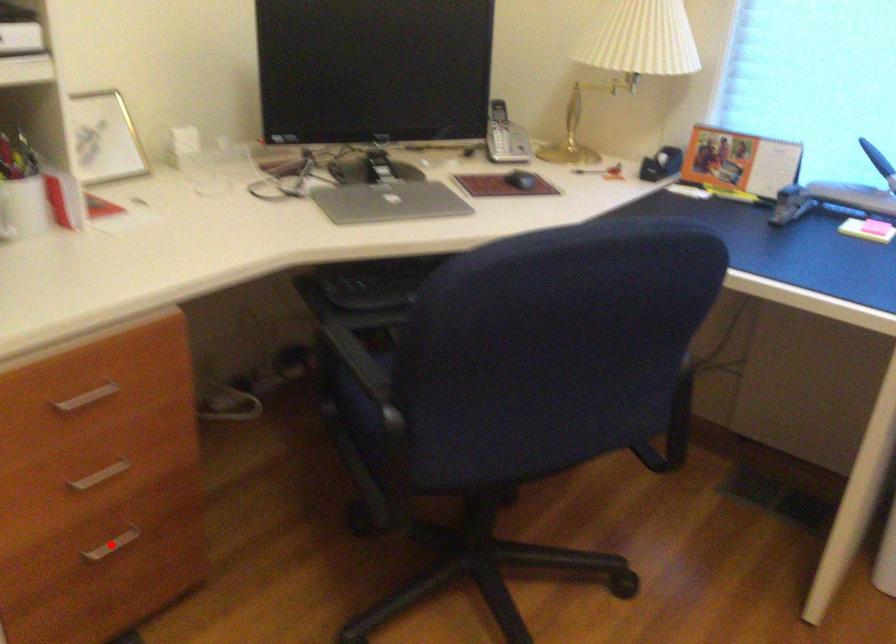
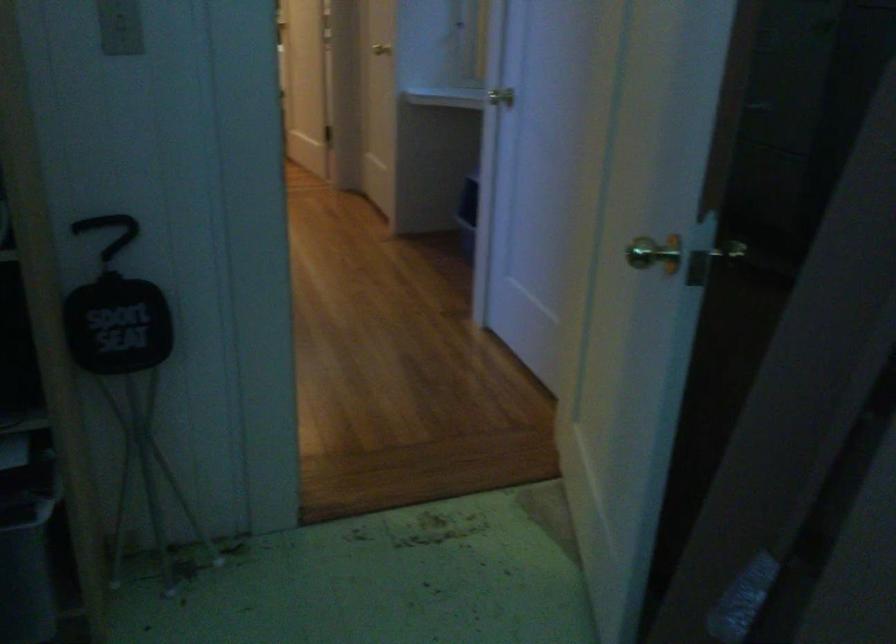
Question: I am providing you with two images of the same scene from different viewpoints. A red point is marked on the first image. At the location where the point appears in image 1, is it still visible in image 2?

Choices:
 (A) Yes
 (B) No

Answer: (B)